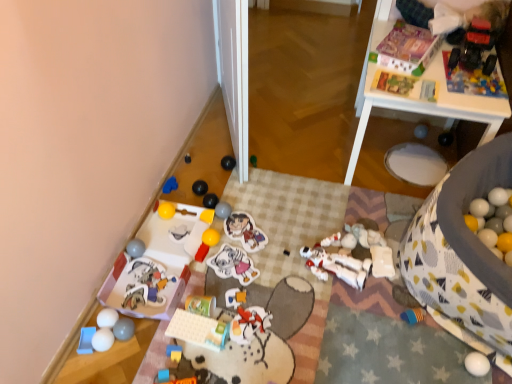
In order to click on free point in front of yellow matte ball at center, arranged as the 14th toy when viewed from the right in this screenshot , I will do click(x=211, y=256).